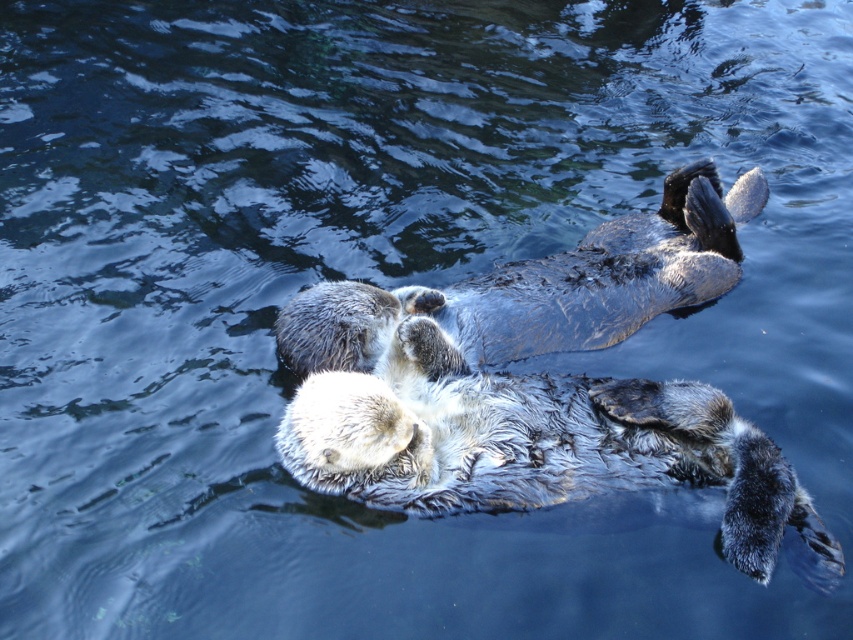
You are a wildlife photographer aiming to capture the soft brown fur of the otter at the center of the image. The coordinates provided are point (x=515, y=429). Based on the scene description, where should you focus your camera to ensure the soft brown fur is in sharp focus?

The point (x=515, y=429) marks the location of the soft brown fur otter at center, so you should focus your camera on that coordinate to ensure the soft brown fur is in sharp focus.